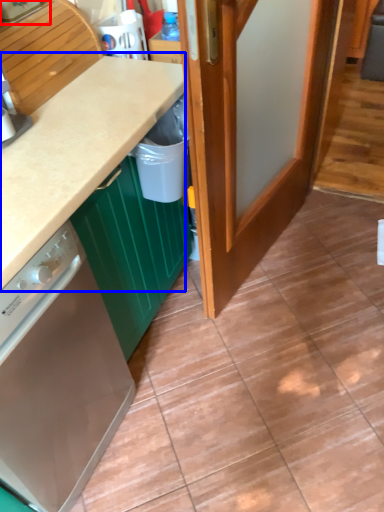
Question: Among these objects, which one is farthest to the camera, kitchen appliance (highlighted by a red box) or countertop (highlighted by a blue box)?

Choices:
 (A) kitchen appliance
 (B) countertop

Answer: (A)